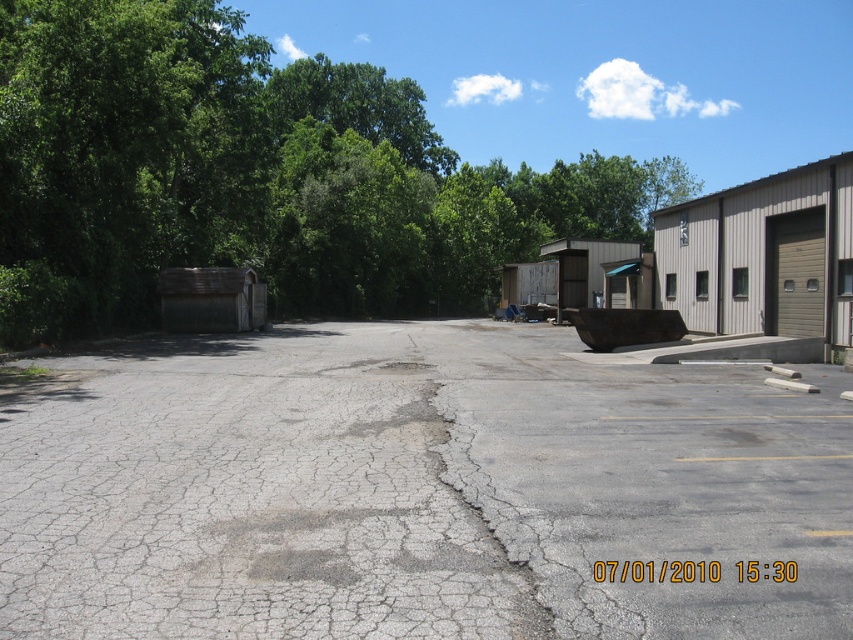
Between gray cracked asphalt at center and green leafy tree at upper left, which one has more height?

green leafy tree at upper left is taller.

Is point (671, 465) positioned in front of point (3, 116)?

Yes, it is.

Locate an element on the screen. This screenshot has width=853, height=640. gray cracked asphalt at center is located at coordinates (416, 490).